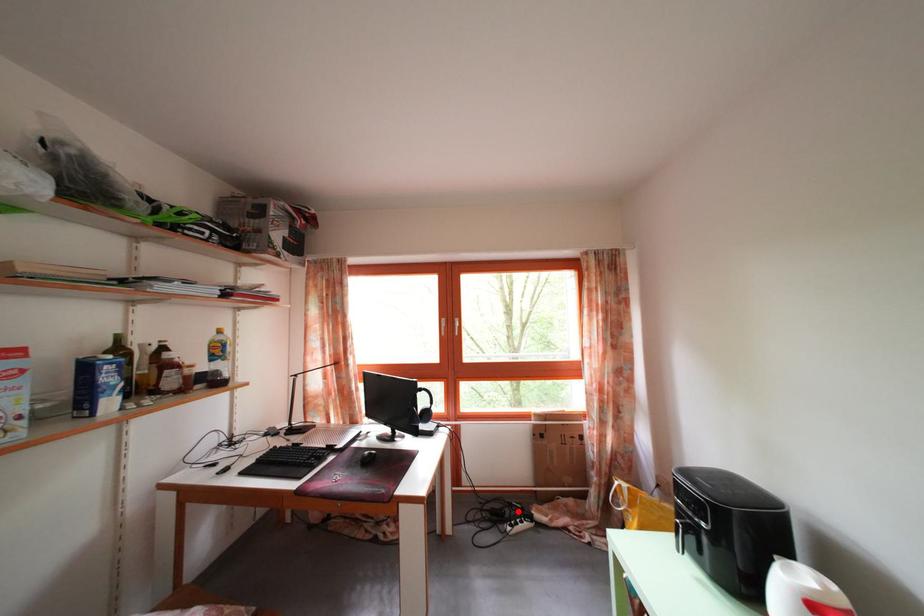
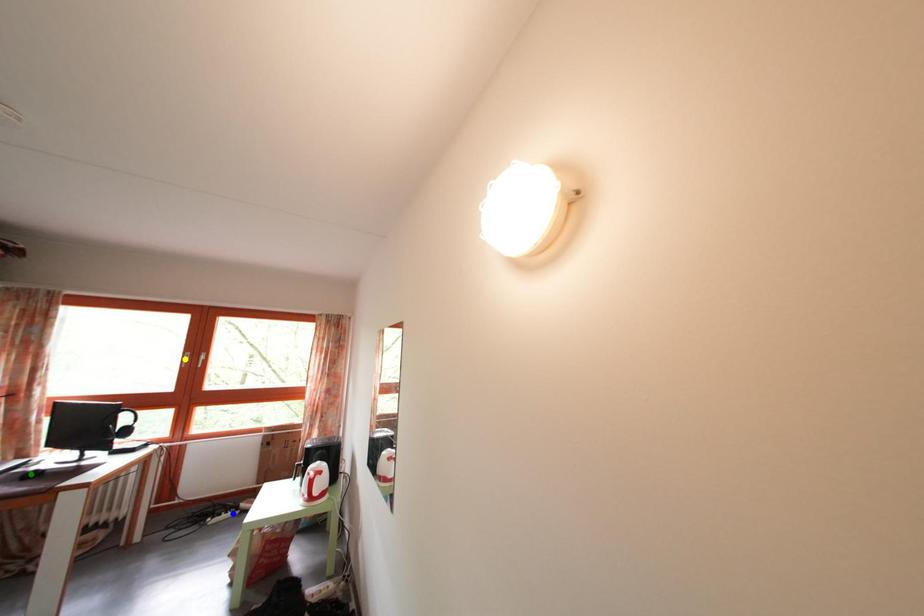
Question: I am providing you with two images of the same scene from different viewpoints. A red point is marked on the first image. You are given multiple points on the second image. Can you choose the point in image 2 that corresponds to the point in image 1?

Choices:
 (A) green point
 (B) yellow point
 (C) blue point

Answer: (C)